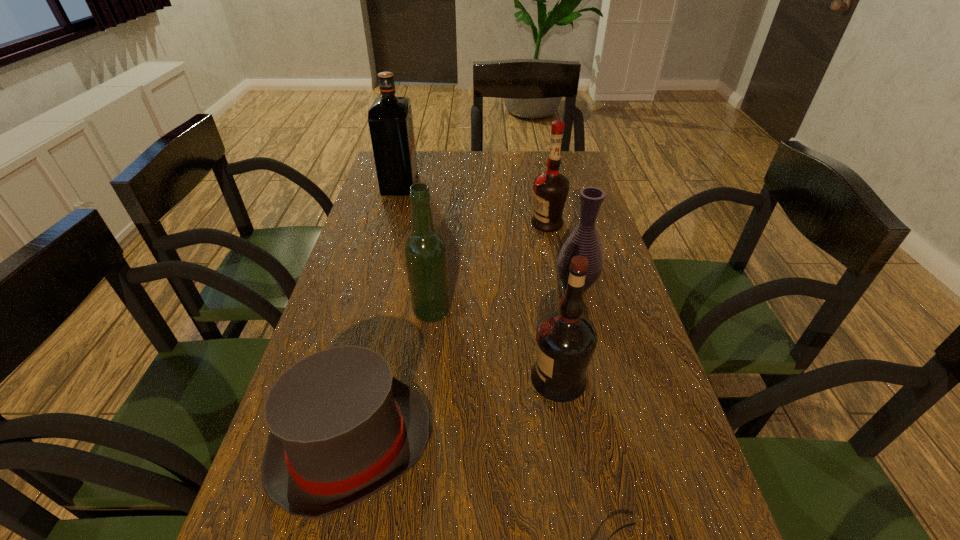
The height and width of the screenshot is (540, 960). Identify the location of the leftmost liquor. (390, 120).

Image resolution: width=960 pixels, height=540 pixels. Find the location of `the farthest liquor`. the farthest liquor is located at coordinates (390, 120).

The width and height of the screenshot is (960, 540). I want to click on the third farthest liquor, so click(425, 249).

The image size is (960, 540). In order to click on the second farthest liquor in this screenshot , I will do `click(550, 189)`.

Identify the location of the nearest liquor. The image size is (960, 540). (566, 339).

Locate an element on the screen. vase is located at coordinates (584, 241).

Where is `dress hat`? dress hat is located at coordinates (342, 427).

Locate an element on the screen. free spot located on the front label of the farthest object is located at coordinates (516, 186).

The height and width of the screenshot is (540, 960). I want to click on vacant space located 0.120m on the right of the second liquor from left to right, so click(x=501, y=311).

Find the location of a particular element. Image resolution: width=960 pixels, height=540 pixels. vacant space situated 0.310m on the front and back of the sixth nearest object is located at coordinates point(427,224).